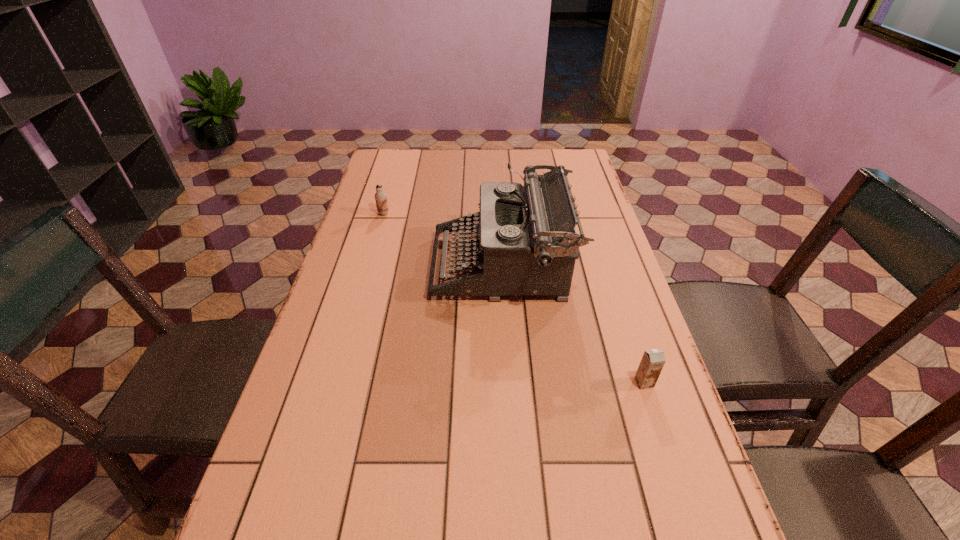
You are a GUI agent. You are given a task and a screenshot of the screen. Output one action in this format:
    pyautogui.click(x=<x>, y=<y>)
    Task: Click on the vacant area located on the front of the nearest object
    The image size is (960, 540).
    Given the screenshot: What is the action you would take?
    pyautogui.click(x=680, y=491)

Locate an element on the screen. Image resolution: width=960 pixels, height=540 pixels. object that is at the left edge is located at coordinates click(380, 196).

You are a GUI agent. You are given a task and a screenshot of the screen. Output one action in this format:
    pyautogui.click(x=<x>, y=<y>)
    Task: Click on the typewriter located at the right edge
    Image resolution: width=960 pixels, height=540 pixels.
    Given the screenshot: What is the action you would take?
    pyautogui.click(x=528, y=245)

The image size is (960, 540). In order to click on chocolate milk present at the right edge in this screenshot , I will do `click(652, 362)`.

The image size is (960, 540). In order to click on blank space at the far edge in this screenshot , I will do `click(462, 151)`.

The image size is (960, 540). Find the location of `vacant space at the left edge of the desktop`. vacant space at the left edge of the desktop is located at coordinates (369, 377).

Where is `free space at the right edge of the desktop`? Image resolution: width=960 pixels, height=540 pixels. free space at the right edge of the desktop is located at coordinates (579, 294).

Where is `free point at the far left corner`? The image size is (960, 540). free point at the far left corner is located at coordinates (414, 151).

I want to click on vacant space at the far right corner, so click(x=550, y=164).

Locate an element on the screen. free spot between the rightmost object and the farther chocolate milk is located at coordinates click(514, 298).